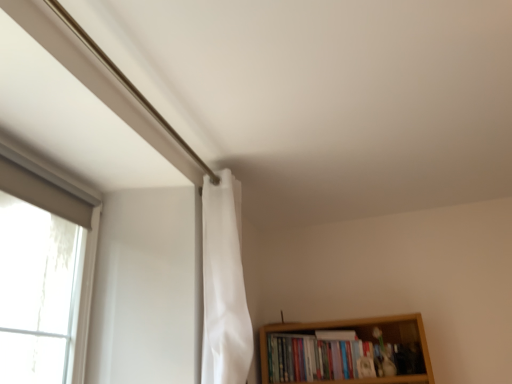
Describe the element at coordinates (338, 359) in the screenshot. The image size is (512, 384). I see `hardcover books at lower right` at that location.

What is the approximate height of hardcover books at lower right?

11.50 inches.

The image size is (512, 384). I want to click on hardcover books at lower right, so click(338, 359).

Describe the element at coordinates (224, 285) in the screenshot. The width and height of the screenshot is (512, 384). I see `white fabric shower curtain at upper center` at that location.

At what (x,y) coordinates should I click in order to perform the action: click on white fabric shower curtain at upper center. Please return your answer as a coordinate pair (x, y). This screenshot has height=384, width=512. Looking at the image, I should click on (224, 285).

Identify the location of hardcover books at lower right. The height and width of the screenshot is (384, 512). (338, 359).

Which object is positioned more to the right, hardcover books at lower right or white fabric shower curtain at upper center?

From the viewer's perspective, hardcover books at lower right appears more on the right side.

Considering their positions, is hardcover books at lower right located in front of or behind white fabric shower curtain at upper center?

In the image, hardcover books at lower right appears behind white fabric shower curtain at upper center.

Is point (290, 373) less distant than point (229, 202)?

No, (290, 373) is further to viewer.

From the image's perspective, is hardcover books at lower right located beneath white fabric shower curtain at upper center?

Yes.

From a real-world perspective, is hardcover books at lower right physically above white fabric shower curtain at upper center?

No, from a real-world perspective, hardcover books at lower right is not above white fabric shower curtain at upper center.

Considering the sizes of hardcover books at lower right and white fabric shower curtain at upper center in the image, is hardcover books at lower right wider or thinner than white fabric shower curtain at upper center?

Clearly, hardcover books at lower right has more width compared to white fabric shower curtain at upper center.

Considering the sizes of objects hardcover books at lower right and white fabric shower curtain at upper center in the image provided, who is taller, hardcover books at lower right or white fabric shower curtain at upper center?

Standing taller between the two is white fabric shower curtain at upper center.

Does hardcover books at lower right have a larger size compared to white fabric shower curtain at upper center?

Yes, hardcover books at lower right is bigger than white fabric shower curtain at upper center.

Is white fabric shower curtain at upper center surrounded by hardcover books at lower right?

Definitely not — white fabric shower curtain at upper center is not inside hardcover books at lower right.

Is hardcover books at lower right beside white fabric shower curtain at upper center?

No, hardcover books at lower right is not making contact with white fabric shower curtain at upper center.

Is hardcover books at lower right aimed at white fabric shower curtain at upper center?

No, hardcover books at lower right is not facing towards white fabric shower curtain at upper center.

Where is `book located behind the white fabric shower curtain at upper center`? book located behind the white fabric shower curtain at upper center is located at coordinates (338, 359).

Does white fabric shower curtain at upper center appear on the right side of hardcover books at lower right?

In fact, white fabric shower curtain at upper center is to the left of hardcover books at lower right.

Is white fabric shower curtain at upper center in front of or behind hardcover books at lower right in the image?

white fabric shower curtain at upper center is in front of hardcover books at lower right.

Looking at this image, which point is more forward, [242,321] or [365,348]?

Positioned in front is point [242,321].

From the image's perspective, is white fabric shower curtain at upper center located above or below hardcover books at lower right?

From the image's perspective, white fabric shower curtain at upper center appears above hardcover books at lower right.

From a real-world perspective, is white fabric shower curtain at upper center above or below hardcover books at lower right?

white fabric shower curtain at upper center is above hardcover books at lower right.

Considering the sizes of objects white fabric shower curtain at upper center and hardcover books at lower right in the image provided, who is wider, white fabric shower curtain at upper center or hardcover books at lower right?

hardcover books at lower right is wider.

Which of these two, white fabric shower curtain at upper center or hardcover books at lower right, stands shorter?

hardcover books at lower right is shorter.

Considering the sizes of objects white fabric shower curtain at upper center and hardcover books at lower right in the image provided, who is bigger, white fabric shower curtain at upper center or hardcover books at lower right?

hardcover books at lower right.

Is white fabric shower curtain at upper center situated inside hardcover books at lower right or outside?

white fabric shower curtain at upper center is not enclosed by hardcover books at lower right.

Is there a large distance between white fabric shower curtain at upper center and hardcover books at lower right?

No, white fabric shower curtain at upper center is not far from hardcover books at lower right.

Is white fabric shower curtain at upper center aimed at hardcover books at lower right?

No, white fabric shower curtain at upper center is not turned towards hardcover books at lower right.

The width and height of the screenshot is (512, 384). I want to click on book lying below the white fabric shower curtain at upper center (from the image's perspective), so click(x=338, y=359).

The image size is (512, 384). In order to click on shower curtain above the hardcover books at lower right (from a real-world perspective) in this screenshot , I will do `click(224, 285)`.

The height and width of the screenshot is (384, 512). Find the location of `book on the right of white fabric shower curtain at upper center`. book on the right of white fabric shower curtain at upper center is located at coordinates (338, 359).